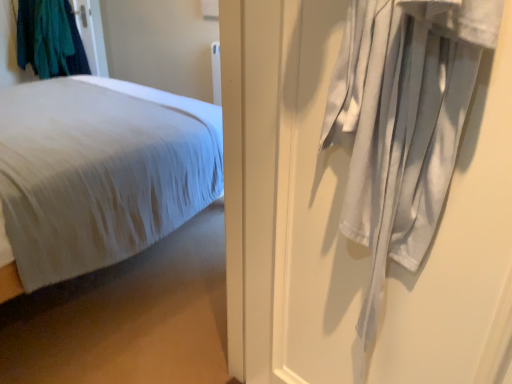
What do you see at coordinates (100, 171) in the screenshot? This screenshot has height=384, width=512. I see `white soft bed at left` at bounding box center [100, 171].

Measure the distance between point (58, 7) and camera.

The depth of point (58, 7) is 3.61 meters.

Where is `white soft bed at left`? Image resolution: width=512 pixels, height=384 pixels. white soft bed at left is located at coordinates (100, 171).

Which is correct: teal fabric at upper left is inside white soft bed at left, or outside of it?

teal fabric at upper left is located beyond the bounds of white soft bed at left.

Considering the sizes of objects teal fabric at upper left and white soft bed at left in the image provided, who is bigger, teal fabric at upper left or white soft bed at left?

With larger size is white soft bed at left.

From the image's perspective, does teal fabric at upper left appear lower than white soft bed at left?

No.

Which point is more forward, (169,135) or (51,70)?

The point (169,135) is closer to the camera.

Is white soft bed at left shorter than teal fabric at upper left?

Yes.

Which is in front, white soft bed at left or teal fabric at upper left?

Positioned in front is white soft bed at left.

Is point (355, 159) closer or farther from the camera than point (74, 207)?

Point (355, 159) is closer to the camera than point (74, 207).

Is white cotton curtain at right to the right of white soft bed at left from the viewer's perspective?

Correct, you'll find white cotton curtain at right to the right of white soft bed at left.

Is white cotton curtain at right inside the boundaries of white soft bed at left, or outside?

white cotton curtain at right is not inside white soft bed at left, it's outside.

Is the position of white cotton curtain at right more distant than that of white soft bed at left?

No.

Do you think white cotton curtain at right is within teal fabric at upper left, or outside of it?

white cotton curtain at right lies outside teal fabric at upper left.

From the image's perspective, which one is positioned lower, white cotton curtain at right or teal fabric at upper left?

white cotton curtain at right.

Is white cotton curtain at right bigger than teal fabric at upper left?

No.

Does white cotton curtain at right appear on the right side of teal fabric at upper left?

Indeed, white cotton curtain at right is positioned on the right side of teal fabric at upper left.

Is white soft bed at left bigger than white cotton curtain at right?

Indeed, white soft bed at left has a larger size compared to white cotton curtain at right.

Is white soft bed at left thinner than white cotton curtain at right?

Incorrect, the width of white soft bed at left is not less than that of white cotton curtain at right.

Is white cotton curtain at right at the back of white soft bed at left?

white soft bed at left is not turned away from white cotton curtain at right.

Would you say white soft bed at left is inside or outside white cotton curtain at right?

white soft bed at left is not enclosed by white cotton curtain at right.

How different are the orientations of teal fabric at upper left and white cotton curtain at right in degrees?

The angular difference between teal fabric at upper left and white cotton curtain at right is 23.2 degrees.

From a real-world perspective, is teal fabric at upper left positioned under white cotton curtain at right based on gravity?

Yes, from a real-world perspective, teal fabric at upper left is below white cotton curtain at right.

Considering the relative sizes of teal fabric at upper left and white cotton curtain at right in the image provided, is teal fabric at upper left wider than white cotton curtain at right?

Yes.

From the image's perspective, is teal fabric at upper left below white cotton curtain at right?

Incorrect, from the image's perspective, teal fabric at upper left is higher than white cotton curtain at right.

Locate an element on the screen. The image size is (512, 384). bed beneath the teal fabric at upper left (from a real-world perspective) is located at coordinates (100, 171).

Locate an element on the screen. The height and width of the screenshot is (384, 512). bed on the right of teal fabric at upper left is located at coordinates (100, 171).

When comparing their distances from white cotton curtain at right, does teal fabric at upper left or white soft bed at left seem further?

Among the two, teal fabric at upper left is located further to white cotton curtain at right.

Estimate the real-world distances between objects in this image. Which object is further from teal fabric at upper left, white soft bed at left or white cotton curtain at right?

white cotton curtain at right is further to teal fabric at upper left.

Looking at the image, which one is located closer to white soft bed at left, teal fabric at upper left or white cotton curtain at right?

Among the two, white cotton curtain at right is located nearer to white soft bed at left.

Based on their spatial positions, is white cotton curtain at right or white soft bed at left closer to teal fabric at upper left?

Among the two, white soft bed at left is located nearer to teal fabric at upper left.

Based on their spatial positions, is white soft bed at left or teal fabric at upper left further from white cotton curtain at right?

teal fabric at upper left.

Based on their spatial positions, is white cotton curtain at right or teal fabric at upper left further from white soft bed at left?

teal fabric at upper left is further to white soft bed at left.

I want to click on bed positioned between white cotton curtain at right and teal fabric at upper left from near to far, so click(x=100, y=171).